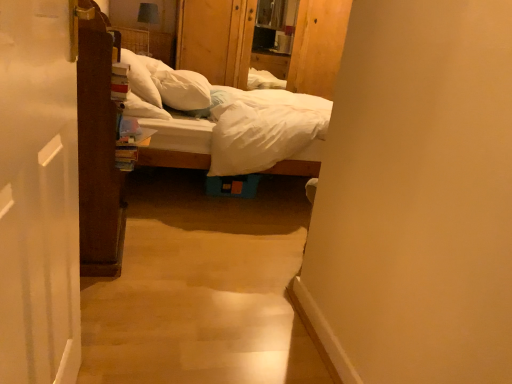
Question: Would you say white cotton bed at center is inside or outside wooden dresser at center?

Choices:
 (A) outside
 (B) inside

Answer: (A)

Question: Considering the positions of white cotton bed at center and wooden dresser at center in the image, is white cotton bed at center wider or thinner than wooden dresser at center?

Choices:
 (A) thin
 (B) wide

Answer: (B)

Question: Which is farther from the white cotton bed at center?

Choices:
 (A) wooden dresser at center
 (B) white soft pillow at upper center, arranged as the first pillow when viewed from the left
 (C) white soft pillow at center, the 2th pillow viewed from the left

Answer: (A)

Question: Which object is positioned closest to the white soft pillow at center, the 2th pillow viewed from the left?

Choices:
 (A) wooden dresser at center
 (B) white soft pillow at upper center, arranged as the first pillow when viewed from the left
 (C) white cotton bed at center

Answer: (B)